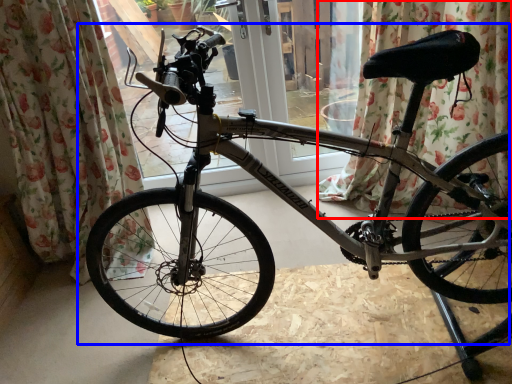
Question: Which point is further to the camera, curtain (highlighted by a red box) or bicycle (highlighted by a blue box)?

Choices:
 (A) curtain
 (B) bicycle

Answer: (A)